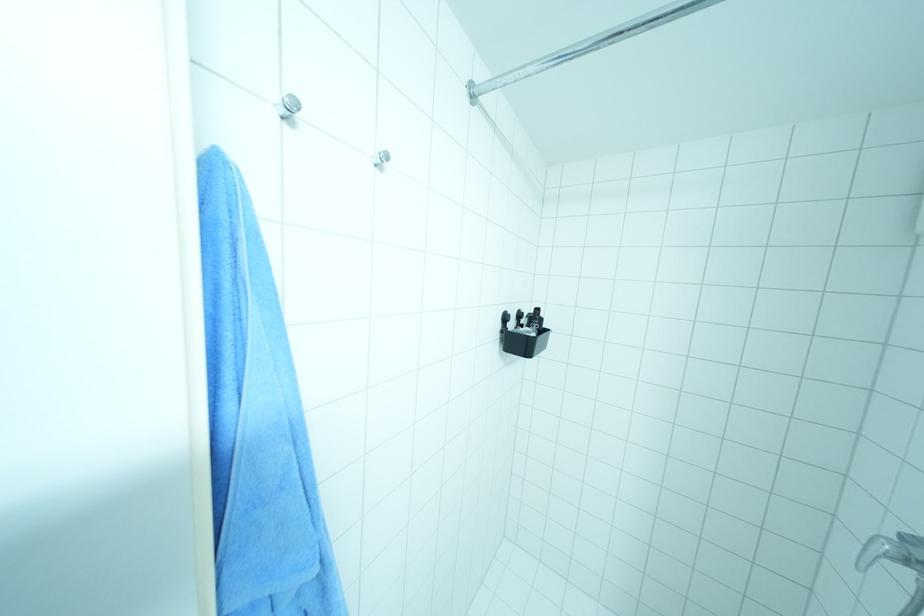
The width and height of the screenshot is (924, 616). Describe the element at coordinates (650, 21) in the screenshot. I see `the shower curtain rod` at that location.